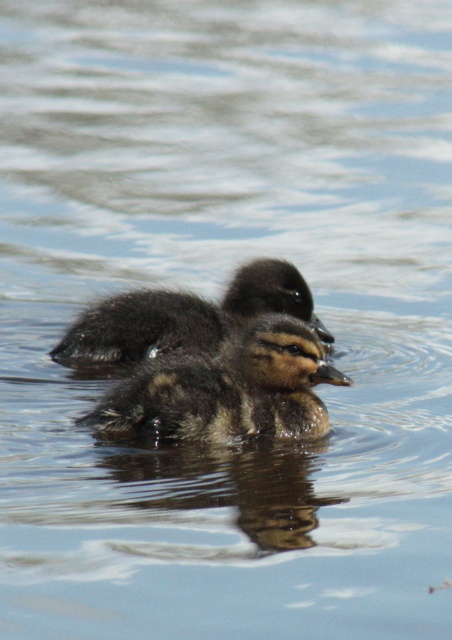
Is brown fuzzy duckling at center wider than dark brown fluffy duckling at center?

No, brown fuzzy duckling at center is not wider than dark brown fluffy duckling at center.

Who is positioned more to the right, brown fuzzy duckling at center or dark brown fluffy duckling at center?

brown fuzzy duckling at center

What do you see at coordinates (227, 388) in the screenshot?
I see `brown fuzzy duckling at center` at bounding box center [227, 388].

Find the location of a particular element. The height and width of the screenshot is (640, 452). brown fuzzy duckling at center is located at coordinates (227, 388).